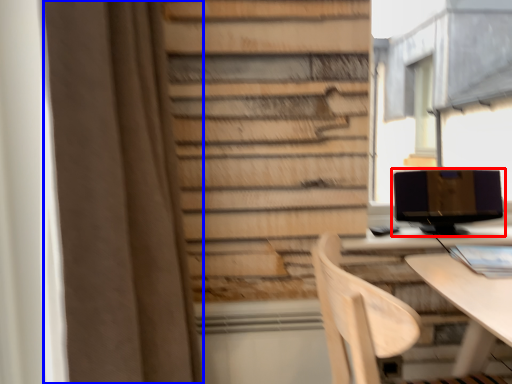
Question: Among these objects, which one is farthest to the camera, computer monitor (highlighted by a red box) or curtain (highlighted by a blue box)?

Choices:
 (A) computer monitor
 (B) curtain

Answer: (A)